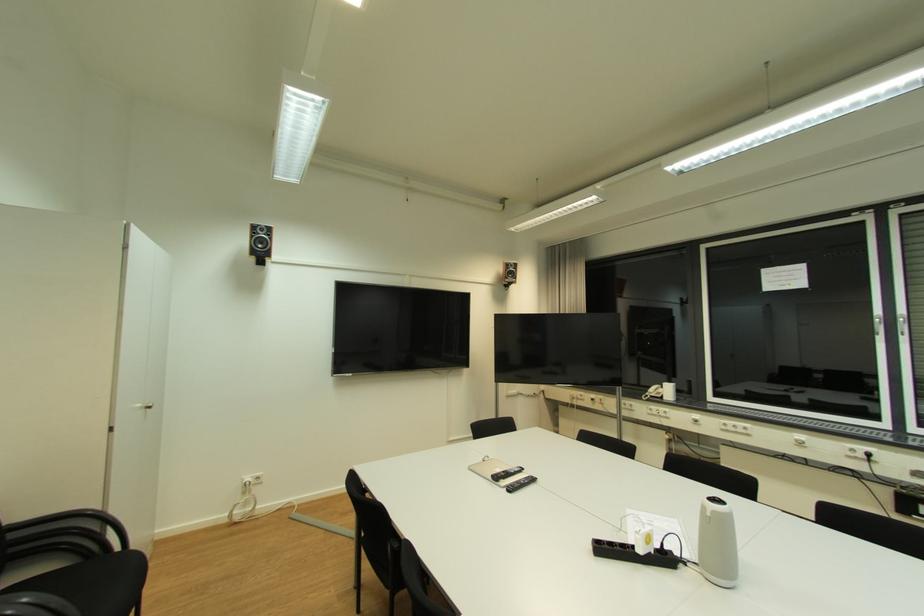
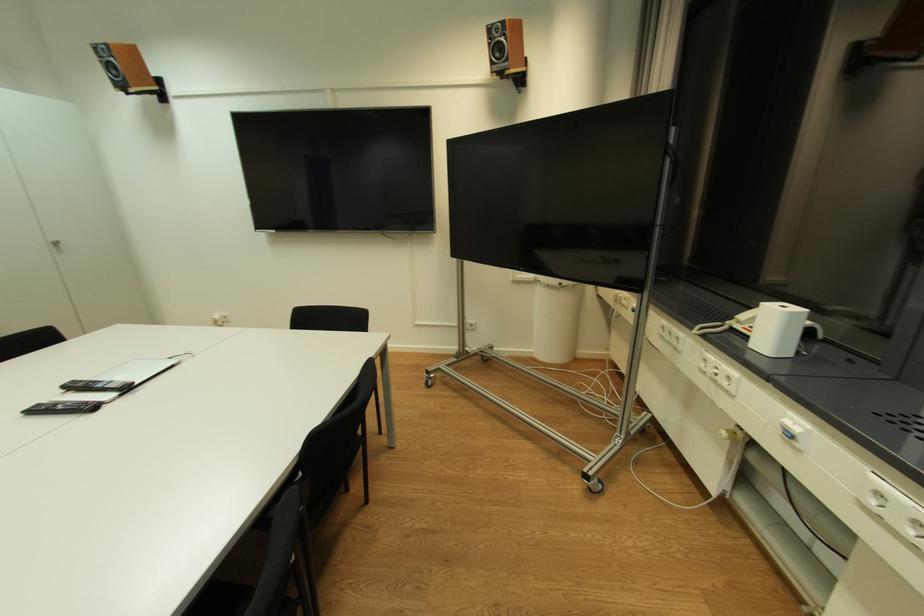
Locate, in the second image, the point that corresponds to the point at 526,400 in the first image.

(544, 290)